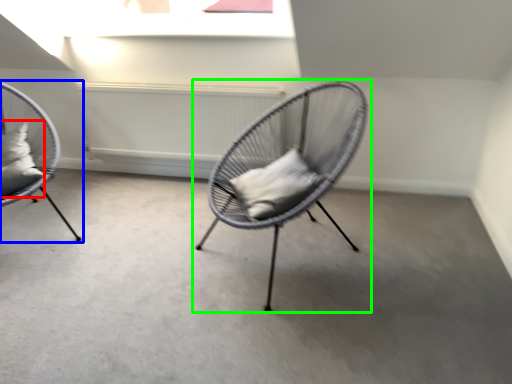
Question: Which object is positioned farthest from pillow (highlighted by a red box)? Select from chair (highlighted by a blue box) and chair (highlighted by a green box).

Choices:
 (A) chair
 (B) chair

Answer: (B)